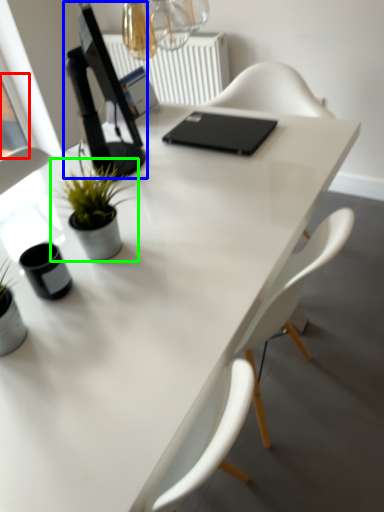
Question: Which object is positioned farthest from window screen (highlighted by a red box)? Select from computer monitor (highlighted by a blue box) and houseplant (highlighted by a green box).

Choices:
 (A) computer monitor
 (B) houseplant

Answer: (B)